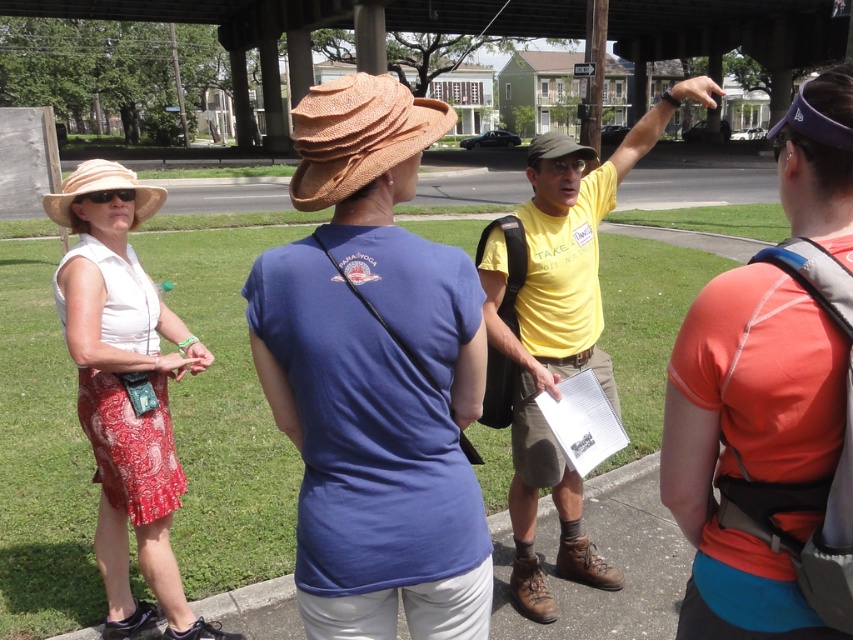
You are standing at the center of the bridge and want to find the matte red dress at left. Based on the coordinates provided, in which direction should you look to locate it?

The matte red dress at left is located at coordinates point (x=125, y=392), which means you should look to the left side to find it.

You are a photographer trying to capture a candid shot of the yellow cotton shirt at center and the matte straw hat at center. The camera you are using has a maximum focus range of 30 inches. Can you capture both subjects in focus without moving the camera?

The matte straw hat at center is 33.13 inches away from the yellow cotton shirt at center. Since the distance between them exceeds the camera maximum focus range of 30 inches, you cannot capture both subjects in focus without moving the camera.

Based on the coordinates provided, which object is located at point (x=374, y=376) in the image?

The point (x=374, y=376) corresponds to the matte straw hat at center.